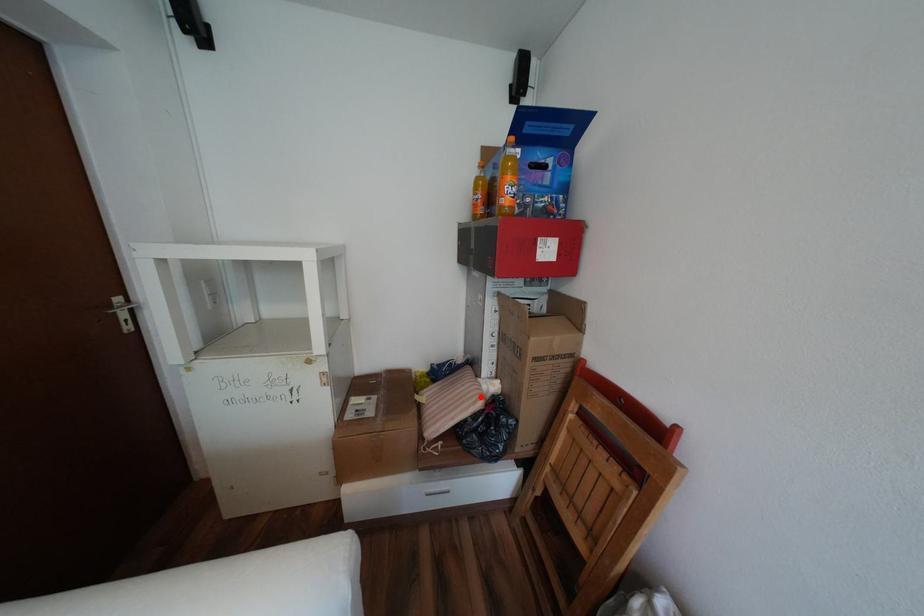
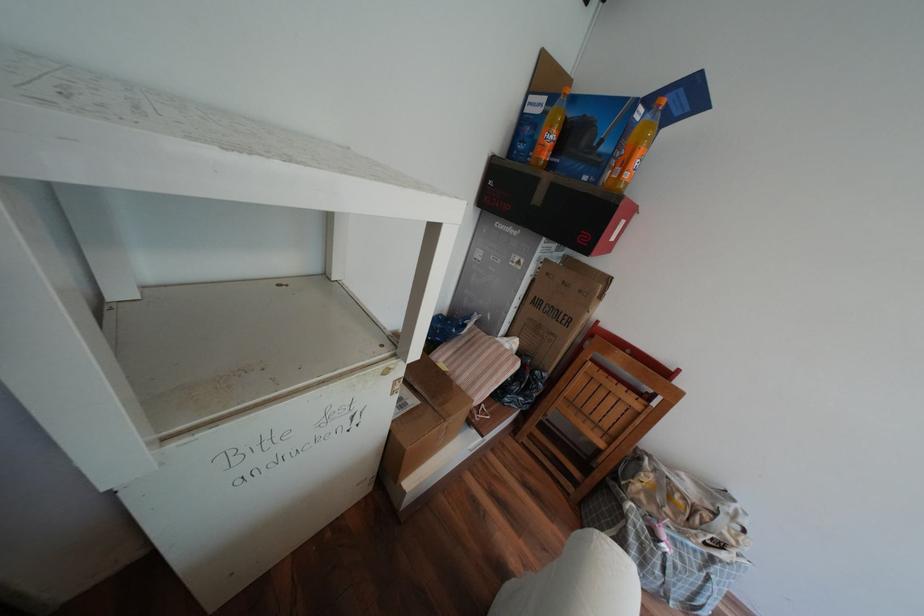
Find the pixel in the second image that matches the highlighted location in the first image.

(517, 360)